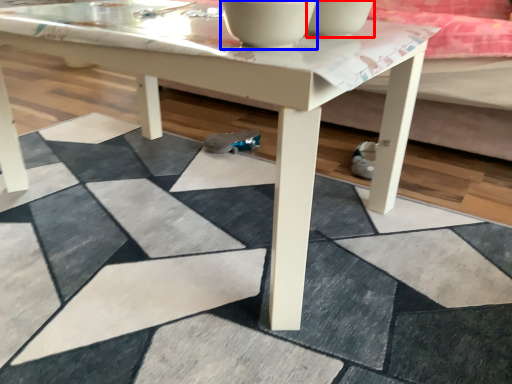
Question: Which point is closer to the camera, bowl (highlighted by a red box) or bowl (highlighted by a blue box)?

Choices:
 (A) bowl
 (B) bowl

Answer: (B)